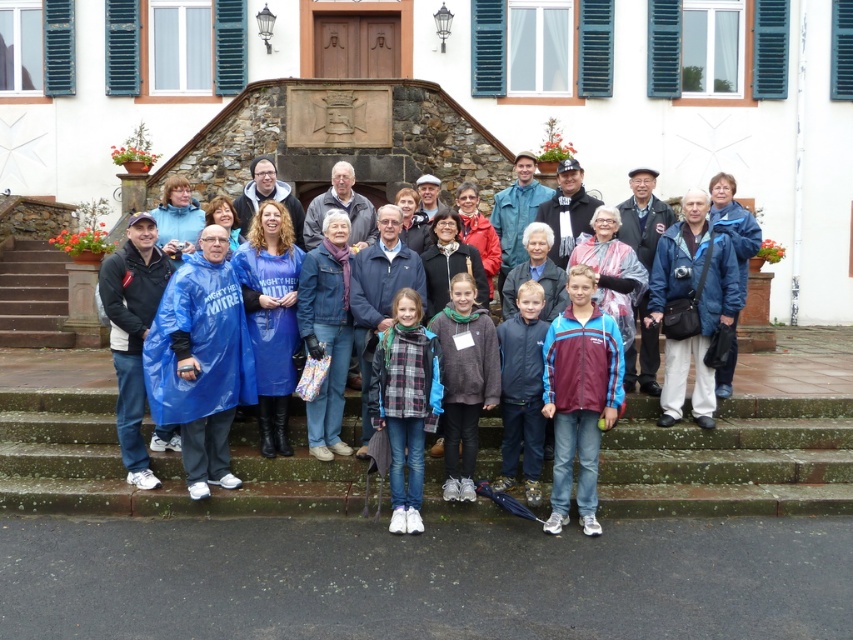
You are standing on the pavement in front of the building and want to go up the stairs. Which stairs, the concrete stairs at center or the brown stone stairs at left, are closer to you?

The concrete stairs at center are closer to you since they are in front of the brown stone stairs at left.